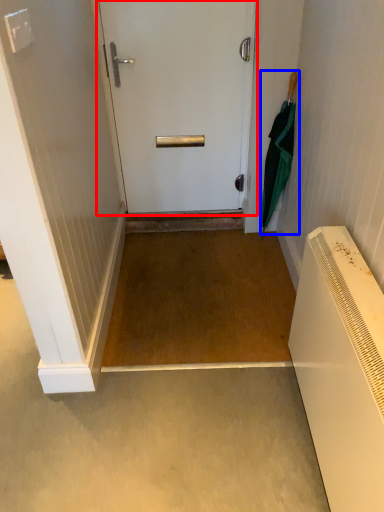
Question: Among these objects, which one is farthest to the camera, door (highlighted by a red box) or umbrella (highlighted by a blue box)?

Choices:
 (A) door
 (B) umbrella

Answer: (A)